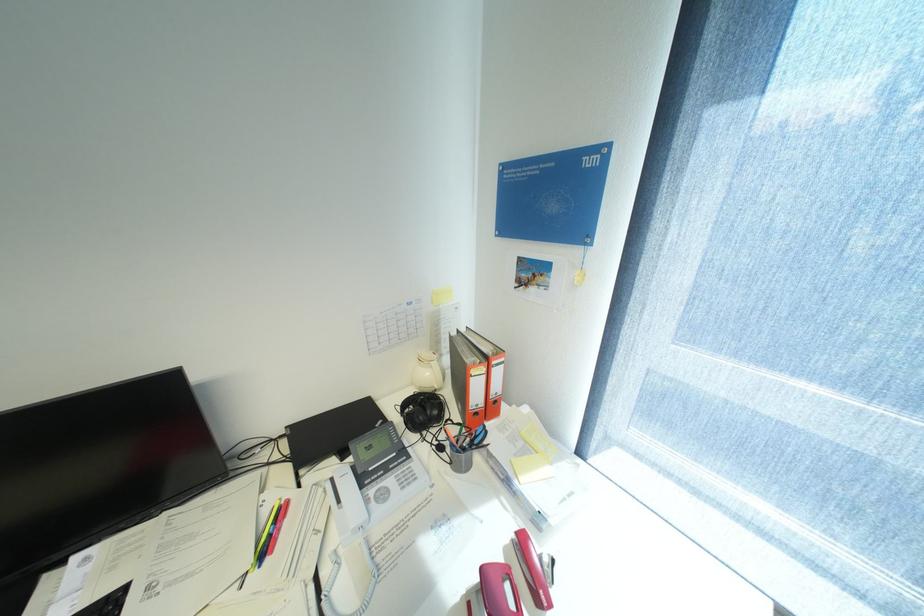
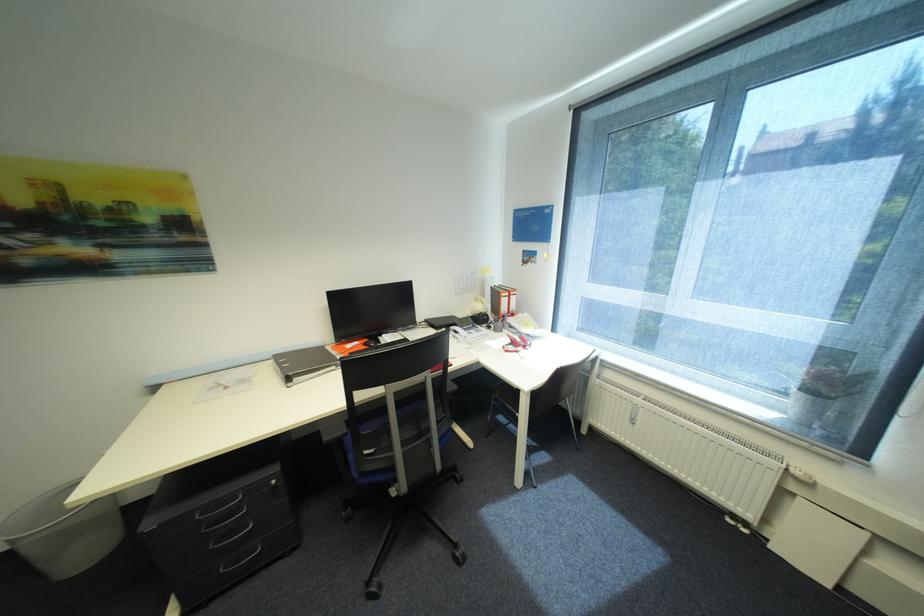
Locate, in the second image, the point that corresponds to [447,448] in the first image.

(496, 328)